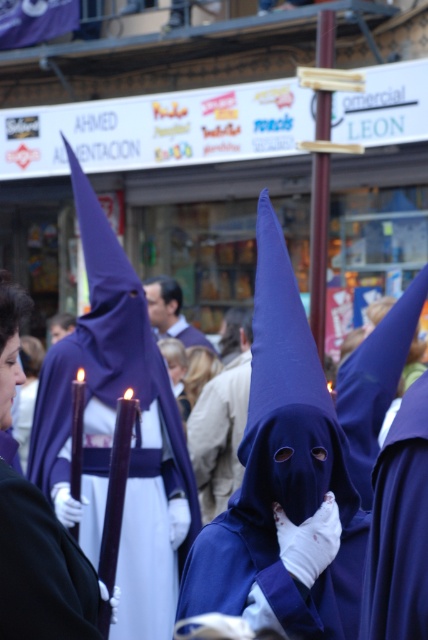
Does purple matte hood at center have a greater width compared to smooth beige coat at center?

Yes.

Is point (293, 289) positioned in front of point (211, 364)?

That is True.

Where is `purple matte hood at center`? purple matte hood at center is located at coordinates (282, 472).

Identify the location of purple matte hood at center. Image resolution: width=428 pixels, height=640 pixels. (282, 472).

Who is more forward, [348,621] or [53,522]?

Point [53,522]

Does purple matte hood at center appear under matte white gloves at center?

No.

Where is `purple matte hood at center`? This screenshot has width=428, height=640. purple matte hood at center is located at coordinates (282, 472).

This screenshot has height=640, width=428. In order to click on purple matte hood at center in this screenshot , I will do `click(282, 472)`.

Who is more forward, (181,608) or (154,369)?

Point (181,608)

Which is more to the right, purple matte hood at center or purple matte cloth at center?

purple matte hood at center

At what (x,y) coordinates should I click in order to perform the action: click on purple matte hood at center. Please return your answer as a coordinate pair (x, y). The width and height of the screenshot is (428, 640). Looking at the image, I should click on (282, 472).

What are the coordinates of `purple matte hood at center` in the screenshot? It's located at (282, 472).